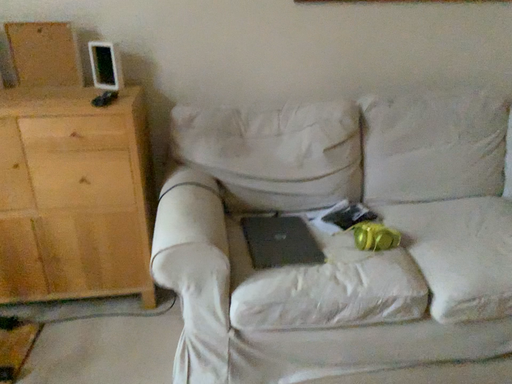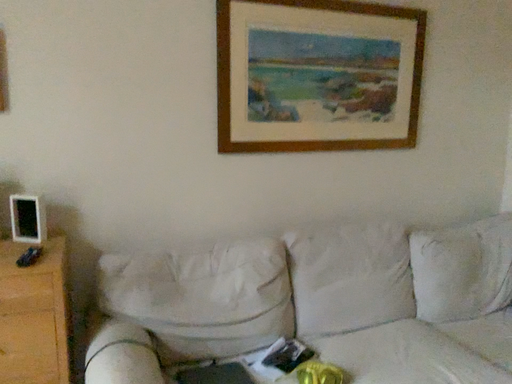
Question: Which way did the camera rotate in the video?

Choices:
 (A) rotated right
 (B) rotated left

Answer: (A)